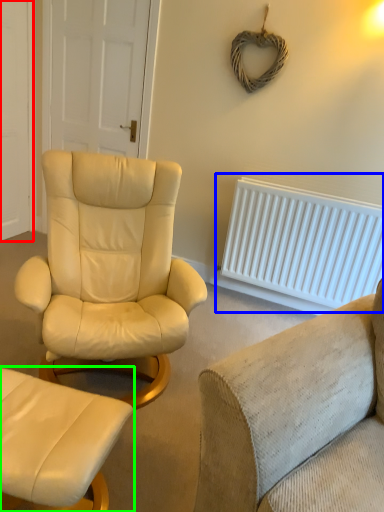
Question: Based on their relative distances, which object is nearer to door (highlighted by a red box)? Choose from radiator (highlighted by a blue box) and chair (highlighted by a green box).

Choices:
 (A) radiator
 (B) chair

Answer: (A)